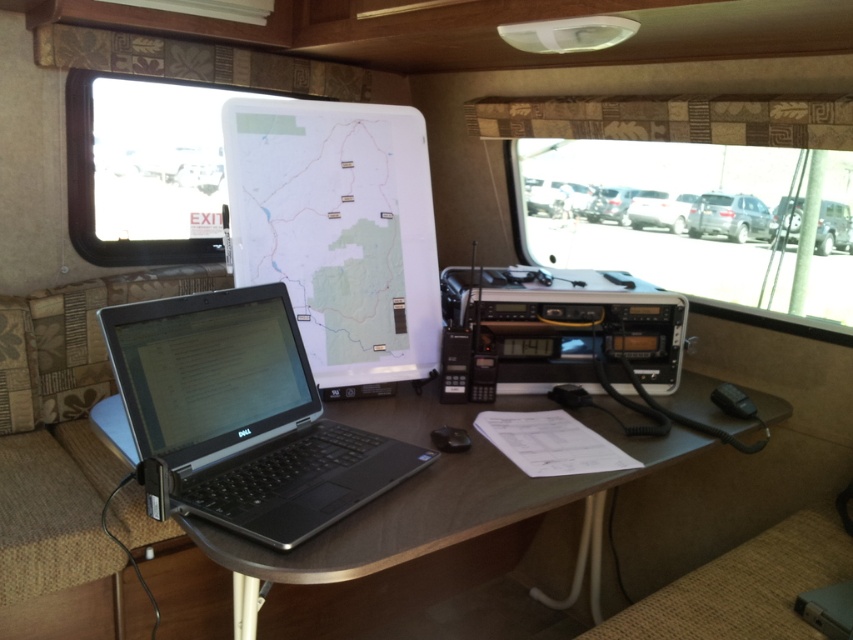
Between point (323, 104) and point (793, 216), which one is positioned in front?

Point (323, 104) is in front.

Where is `white matte map at center`? white matte map at center is located at coordinates pos(338,230).

Is silver/black plastic laptop at lower left to the left of black plastic table at center from the viewer's perspective?

Yes, silver/black plastic laptop at lower left is to the left of black plastic table at center.

Is point (144, 339) closer to camera compared to point (468, 477)?

Yes, it is in front of point (468, 477).

Find the location of a particular element. The height and width of the screenshot is (640, 853). silver/black plastic laptop at lower left is located at coordinates (241, 417).

In the scene shown: Is silver/black plastic laptop at lower left above satin silver suv at center?

Actually, silver/black plastic laptop at lower left is below satin silver suv at center.

What do you see at coordinates (241, 417) in the screenshot? I see `silver/black plastic laptop at lower left` at bounding box center [241, 417].

The image size is (853, 640). I want to click on silver/black plastic laptop at lower left, so click(x=241, y=417).